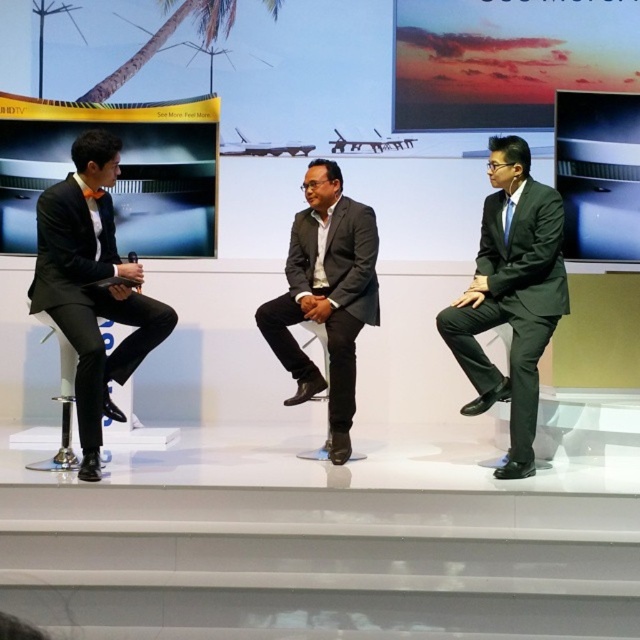
From the picture: Who is lower down, matte black suit at right or matte gray suit at center?

matte gray suit at center is lower down.

Does point (497, 321) come farther from viewer compared to point (356, 284)?

That is False.

You are a GUI agent. You are given a task and a screenshot of the screen. Output one action in this format:
    pyautogui.click(x=<x>, y=<y>)
    Task: Click on the matte black suit at right
    This screenshot has width=640, height=640.
    Given the screenshot: What is the action you would take?
    pyautogui.click(x=512, y=296)

Is matte black suit at right further to the viewer compared to black matte suit at left?

That is True.

Based on the photo, can you confirm if matte black suit at right is positioned to the right of black matte suit at left?

Yes, matte black suit at right is to the right of black matte suit at left.

Locate an element on the screen. The width and height of the screenshot is (640, 640). matte black suit at right is located at coordinates (512, 296).

Which is behind, point (52, 282) or point (336, 301)?

Point (336, 301)

Does black matte suit at left appear on the right side of matte gray suit at center?

No, black matte suit at left is not to the right of matte gray suit at center.

Who is more forward, [124,339] or [339,326]?

Point [124,339] is in front.

I want to click on black matte suit at left, so click(x=92, y=292).